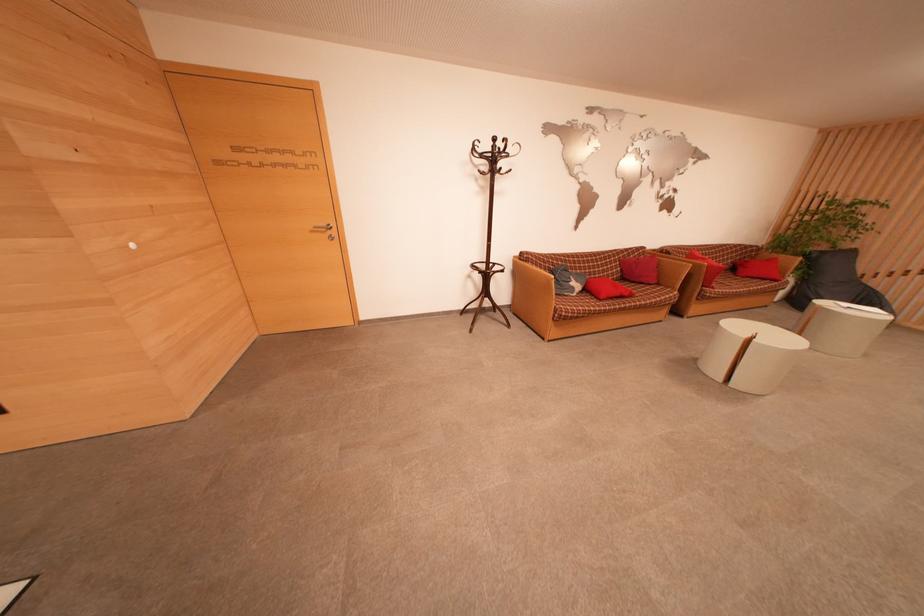
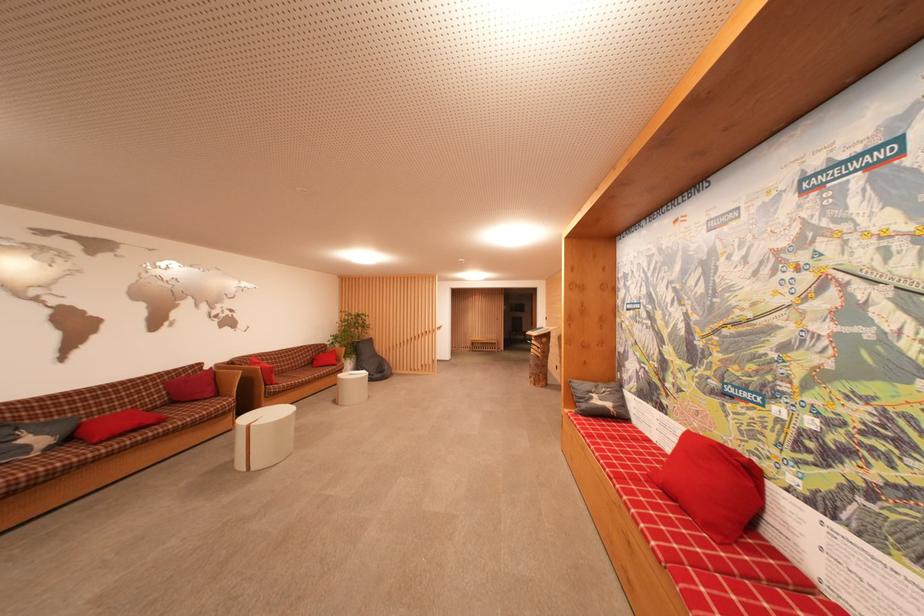
In the second image, find the point that corresponds to point 779,262 in the first image.

(338, 354)